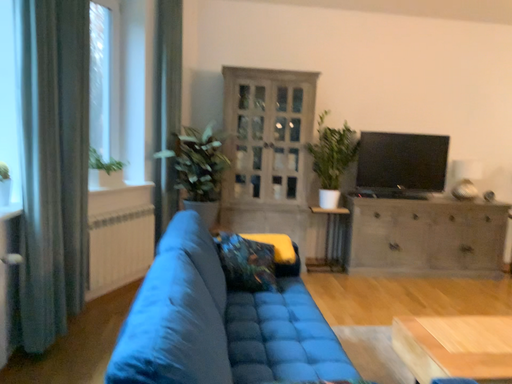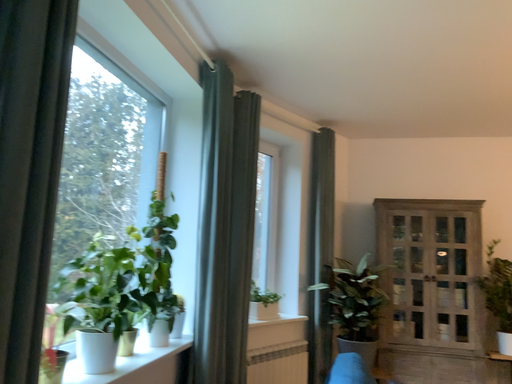
Question: How did the camera likely rotate when shooting the video?

Choices:
 (A) rotated right
 (B) rotated left

Answer: (B)